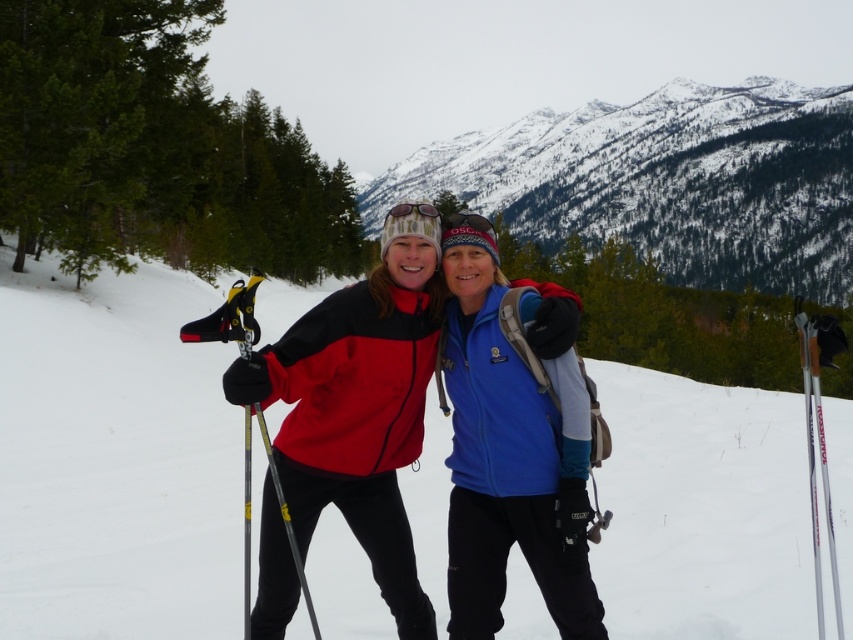
You are trying to decide which item to wear for better visibility in the snow. The matte pink sunglasses at center and the translucent plastic goggles at center are both available. Which one has a larger frame size?

The matte pink sunglasses at center is larger in size than the translucent plastic goggles at center, so it has a larger frame size.

You are planning to take a photo of the snowy mountain at center and the translucent plastic goggles at center. Based on their sizes, which object should you focus on first to ensure both are in frame?

The snowy mountain at center is larger than the translucent plastic goggles at center, so you should focus on the snowy mountain at center first to ensure both are in frame.

You are planning to build a snowman using the white powder snow at center and the snowy mountain at center. Which object should you use as the base of the snowman?

The white powder snow at center is to the left of the snowy mountain at center, so you should use the white powder snow at center as the base of the snowman because it is closer to you.